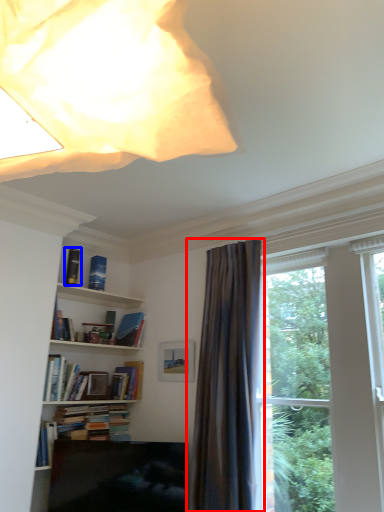
Question: Which object appears closest to the camera in this image, curtain (highlighted by a red box) or book (highlighted by a blue box)?

Choices:
 (A) curtain
 (B) book

Answer: (A)